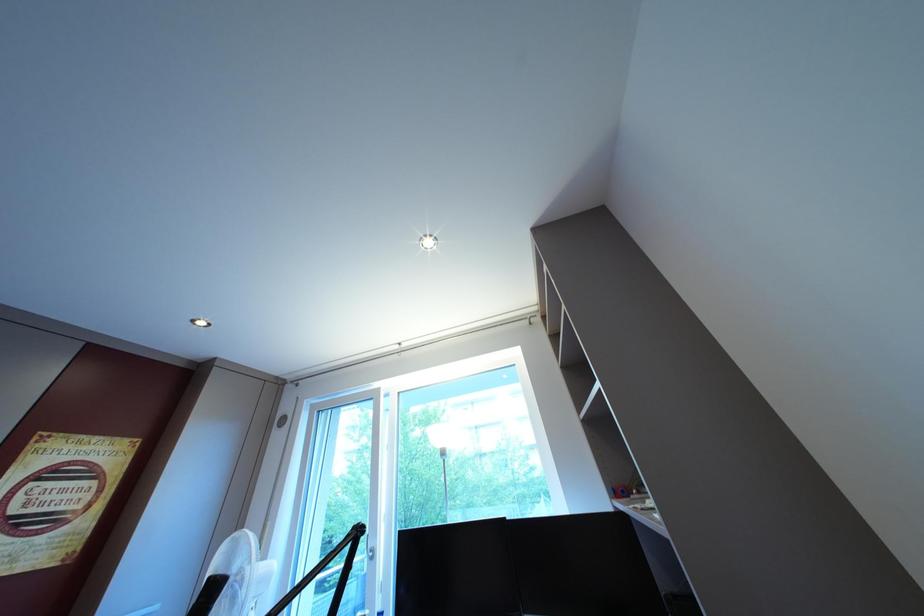
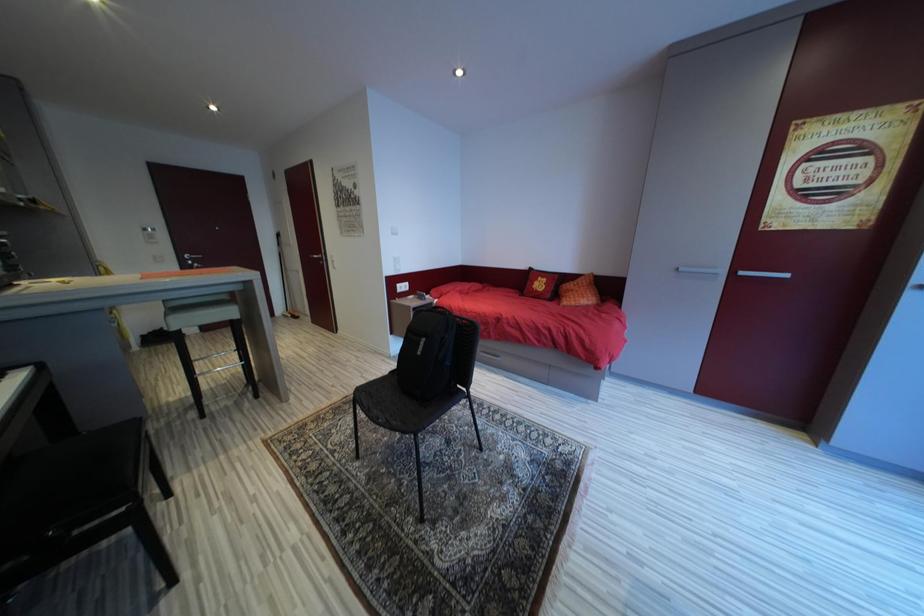
Question: The camera is either moving clockwise (left) or counter-clockwise (right) around the object. The first image is from the beginning of the video and the second image is from the end. Is the camera moving left or right when shooting the video?

Choices:
 (A) Left
 (B) Right

Answer: (B)